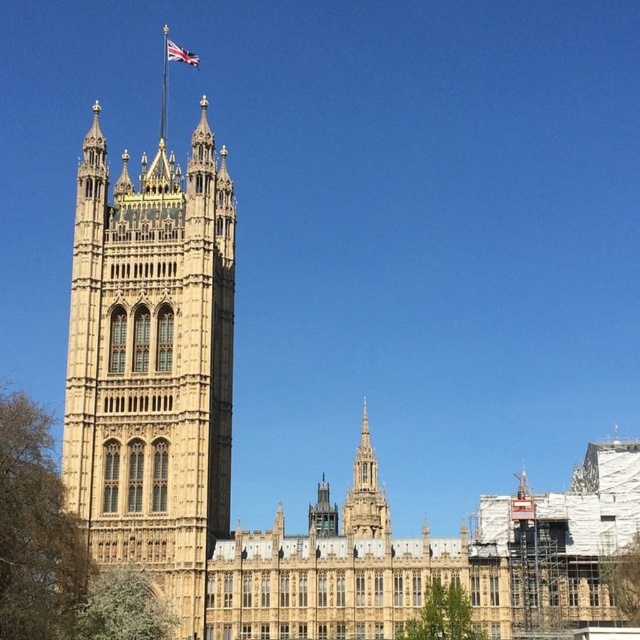
Question: Which object is the closest to the union jack fabric at top center?

Choices:
 (A) golden stone spire at center
 (B) golden stone tower at left

Answer: (B)

Question: Can you confirm if golden stone tower at left is positioned to the left of union jack fabric at top center?

Choices:
 (A) yes
 (B) no

Answer: (A)

Question: Which object is positioned closest to the golden stone tower at left?

Choices:
 (A) golden stone spire at center
 (B) union jack fabric at top center

Answer: (A)

Question: Which of the following is the farthest from the observer?

Choices:
 (A) (180, 48)
 (B) (218, 458)

Answer: (A)

Question: Is golden stone spire at center bigger than union jack fabric at top center?

Choices:
 (A) yes
 (B) no

Answer: (A)

Question: Is golden stone spire at center below union jack fabric at top center?

Choices:
 (A) yes
 (B) no

Answer: (A)